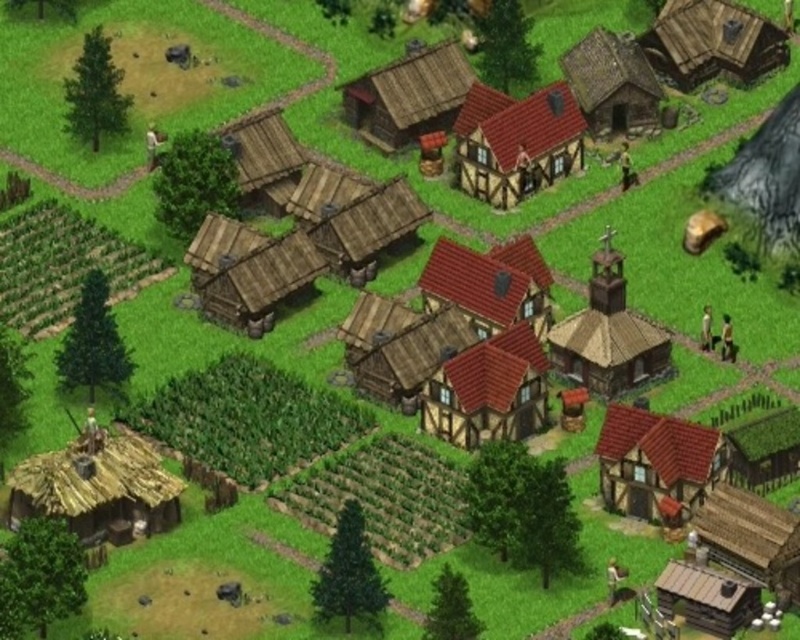
Does brown wooden house at center lie behind brown wooden church at center?

Yes, brown wooden house at center is further from the viewer.

Between brown wooden house at center and brown wooden church at center, which one appears on the right side from the viewer's perspective?

From the viewer's perspective, brown wooden church at center appears more on the right side.

Is point (466, 113) closer to camera compared to point (625, 340)?

No, it is not.

Where is `brown wooden house at center`? This screenshot has width=800, height=640. brown wooden house at center is located at coordinates (516, 141).

Can you confirm if thatched straw hut at lower left is positioned above green thatched roof hut at lower right?

No, thatched straw hut at lower left is not above green thatched roof hut at lower right.

Who is more forward, (166, 499) or (784, 426)?

Point (166, 499)

The image size is (800, 640). I want to click on thatched straw hut at lower left, so click(97, 488).

Locate an element on the screen. thatched straw hut at lower left is located at coordinates (97, 488).

Who is more forward, (692, 428) or (629, 362)?

Point (692, 428) is more forward.

Is matte brown wooden hut at lower right thinner than brown wooden church at center?

Indeed, matte brown wooden hut at lower right has a lesser width compared to brown wooden church at center.

At what (x,y) coordinates should I click in order to perform the action: click on matte brown wooden hut at lower right. Please return your answer as a coordinate pair (x, y). Looking at the image, I should click on tap(656, 460).